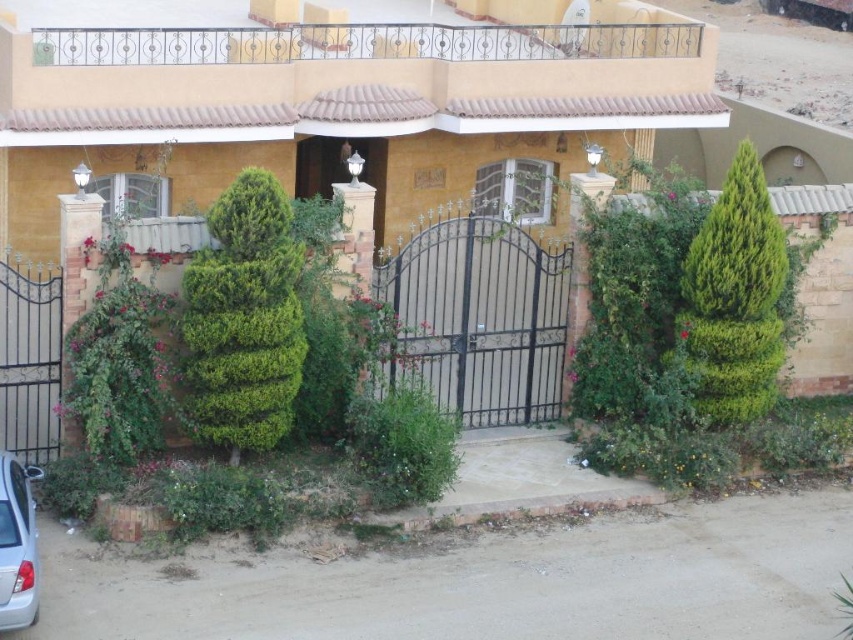
Is point (744, 371) closer to viewer compared to point (28, 548)?

No, it is behind (28, 548).

Which is more to the left, green textured bush at right or white glossy car at lower left?

white glossy car at lower left is more to the left.

What are the coordinates of `green textured bush at right` in the screenshot? It's located at (735, 298).

At what (x,y) coordinates should I click in order to perform the action: click on green textured bush at right. Please return your answer as a coordinate pair (x, y). Image resolution: width=853 pixels, height=640 pixels. Looking at the image, I should click on (735, 298).

Between point (258, 260) and point (717, 241), which one is positioned behind?

The point (717, 241) is behind.

Which is below, green leafy hedge at center or green textured bush at right?

green leafy hedge at center

Locate an element on the screen. Image resolution: width=853 pixels, height=640 pixels. green leafy hedge at center is located at coordinates (244, 320).

Between green leafy hedge at center and white glossy car at lower left, which one has less height?

white glossy car at lower left is shorter.

Can you confirm if green leafy hedge at center is thinner than white glossy car at lower left?

Incorrect, green leafy hedge at center's width is not less than white glossy car at lower left's.

Does point (210, 355) come farther from viewer compared to point (32, 564)?

That is True.

This screenshot has width=853, height=640. What are the coordinates of `green leafy hedge at center` in the screenshot? It's located at (244, 320).